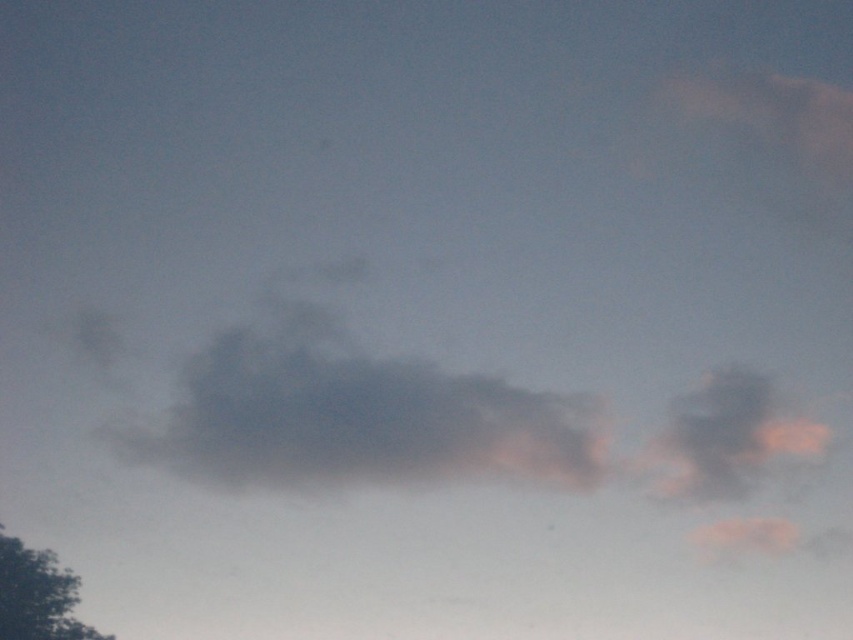
Which of these two, dark gray fluffy cloud at center or green leafy tree at lower left, stands taller?

With more height is dark gray fluffy cloud at center.

Is dark gray fluffy cloud at center to the left of green leafy tree at lower left from the viewer's perspective?

No, dark gray fluffy cloud at center is not to the left of green leafy tree at lower left.

Is point (534, 428) in front of point (50, 552)?

Yes.

Where is `dark gray fluffy cloud at center`? The width and height of the screenshot is (853, 640). dark gray fluffy cloud at center is located at coordinates (355, 413).